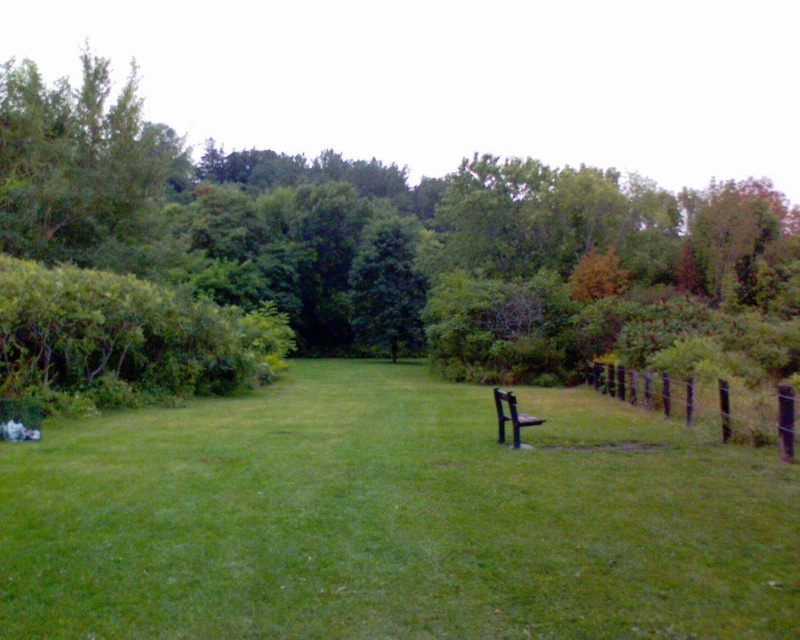
Can you confirm if brown wooden fence at right is shorter than black metal bench at center?

Correct, brown wooden fence at right is not as tall as black metal bench at center.

Can you confirm if brown wooden fence at right is positioned to the left of black metal bench at center?

No, brown wooden fence at right is not to the left of black metal bench at center.

The image size is (800, 640). What are the coordinates of `brown wooden fence at right` in the screenshot? It's located at (706, 403).

This screenshot has width=800, height=640. In order to click on brown wooden fence at right in this screenshot , I will do `click(706, 403)`.

Is green grassy at center to the left of brown wooden fence at right from the viewer's perspective?

Indeed, green grassy at center is positioned on the left side of brown wooden fence at right.

Image resolution: width=800 pixels, height=640 pixels. Identify the location of green grassy at center. (393, 518).

You are a GUI agent. You are given a task and a screenshot of the screen. Output one action in this format:
    pyautogui.click(x=<x>, y=<y>)
    Task: Click on the green grassy at center
    
    Given the screenshot: What is the action you would take?
    pyautogui.click(x=393, y=518)

Consider the image. Which is more to the left, green grassy at center or black metal bench at center?

Positioned to the left is green grassy at center.

Which of these two, green grassy at center or black metal bench at center, stands shorter?

With less height is green grassy at center.

Does point (165, 625) come closer to viewer compared to point (509, 412)?

Yes, point (165, 625) is in front of point (509, 412).

You are a GUI agent. You are given a task and a screenshot of the screen. Output one action in this format:
    pyautogui.click(x=<x>, y=<y>)
    Task: Click on the green grassy at center
    The image size is (800, 640).
    Given the screenshot: What is the action you would take?
    pyautogui.click(x=393, y=518)